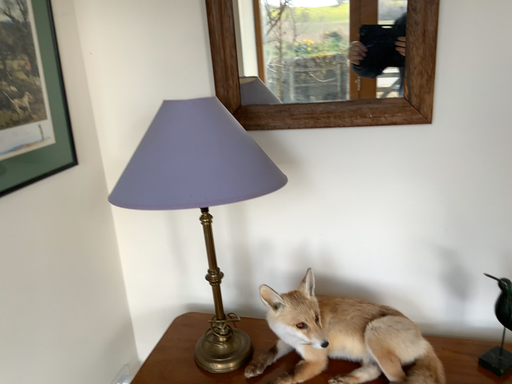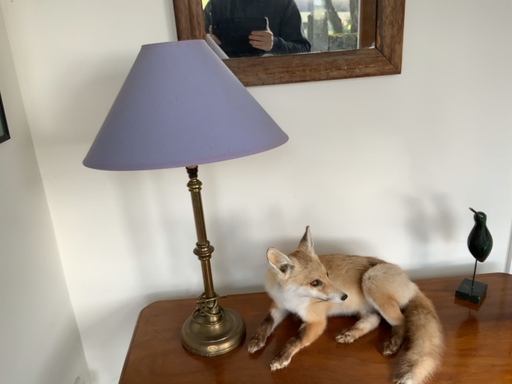
Question: How did the camera likely rotate when shooting the video?

Choices:
 (A) rotated left
 (B) rotated right

Answer: (B)